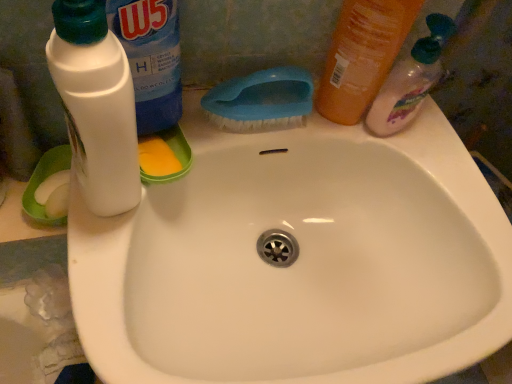
How much space does translucent plastic bottle at upper right, acting as the 2th cleaning product starting from the right, occupy horizontally?

It is 1.96 inches.

This screenshot has width=512, height=384. Identify the location of blue plastic brush at upper center. point(261,100).

Locate an element on the screen. This screenshot has height=384, width=512. translucent plastic bottle at upper right, which is the third cleaning product in left-to-right order is located at coordinates click(x=410, y=80).

Does white matte bottle at left come in front of translucent plastic bottle at upper right, marked as the 1th cleaning product in a right-to-left arrangement?

Yes, white matte bottle at left is closer to the camera.

I want to click on cleaning product that is the 1st one when counting upward from the white matte bottle at left (from the image's perspective), so click(410, 80).

Considering the sizes of white matte bottle at left and translucent plastic bottle at upper right, which is the third cleaning product in left-to-right order, in the image, is white matte bottle at left wider or thinner than translucent plastic bottle at upper right, which is the third cleaning product in left-to-right order,?

white matte bottle at left is wider than translucent plastic bottle at upper right, which is the third cleaning product in left-to-right order.

Which of these two, white matte bottle at left or translucent plastic bottle at upper right, marked as the 1th cleaning product in a right-to-left arrangement, is bigger?

With larger size is white matte bottle at left.

In the image, is translucent plastic bottle at upper right, marked as the 1th cleaning product in a right-to-left arrangement, positioned in front of or behind translucent plastic bottle at upper right, the 2th cleaning product from the left?

translucent plastic bottle at upper right, marked as the 1th cleaning product in a right-to-left arrangement, is behind translucent plastic bottle at upper right, the 2th cleaning product from the left.

How many degrees apart are the facing directions of translucent plastic bottle at upper right, marked as the 1th cleaning product in a right-to-left arrangement, and translucent plastic bottle at upper right, acting as the 2th cleaning product starting from the right?

translucent plastic bottle at upper right, marked as the 1th cleaning product in a right-to-left arrangement, and translucent plastic bottle at upper right, acting as the 2th cleaning product starting from the right, are facing 59.7 degrees away from each other.

Is translucent plastic bottle at upper right, marked as the 1th cleaning product in a right-to-left arrangement, thinner than translucent plastic bottle at upper right, the 2th cleaning product from the left?

In fact, translucent plastic bottle at upper right, marked as the 1th cleaning product in a right-to-left arrangement, might be wider than translucent plastic bottle at upper right, the 2th cleaning product from the left.

From a real-world perspective, which object rests below the other?

translucent plastic bottle at upper right, marked as the 1th cleaning product in a right-to-left arrangement, from a real-world perspective.

Which of these two, white glossy sink at center or white plastic bottle at upper left, the 3th cleaning product viewed from the right, is thinner?

white plastic bottle at upper left, the 3th cleaning product viewed from the right.

Does point (443, 151) lie behind point (148, 47)?

Yes, point (443, 151) is behind point (148, 47).

Which is correct: white glossy sink at center is inside white plastic bottle at upper left, the 1th cleaning product from the left, or outside of it?

white glossy sink at center is not enclosed by white plastic bottle at upper left, the 1th cleaning product from the left.

Could you tell me if white glossy sink at center is facing white plastic bottle at upper left, the 1th cleaning product from the left?

No, white glossy sink at center is not turned towards white plastic bottle at upper left, the 1th cleaning product from the left.

Is blue plastic brush at upper center at the right side of white matte bottle at left?

Yes.

Considering the relative sizes of blue plastic brush at upper center and white matte bottle at left in the image provided, is blue plastic brush at upper center taller than white matte bottle at left?

No, blue plastic brush at upper center is not taller than white matte bottle at left.

From the image's perspective, who appears lower, blue plastic brush at upper center or white matte bottle at left?

white matte bottle at left.

Considering the positions of objects blue plastic brush at upper center and white matte bottle at left in the image provided, who is behind, blue plastic brush at upper center or white matte bottle at left?

blue plastic brush at upper center is further away from the camera.

From a real-world perspective, which cleaning product is the 2nd one above the blue plastic brush at upper center? Please provide its 2D coordinates.

[(362, 55)]

Is point (386, 16) positioned before point (295, 83)?

Yes.

Does translucent plastic bottle at upper right, acting as the 2th cleaning product starting from the right, appear on the left side of blue plastic brush at upper center?

No.

Could you tell me if translucent plastic bottle at upper right, the 2th cleaning product from the left, is facing blue plastic brush at upper center?

No, translucent plastic bottle at upper right, the 2th cleaning product from the left, is not turned towards blue plastic brush at upper center.

Is white glossy sink at center oriented towards translucent plastic bottle at upper right, the 2th cleaning product from the left?

No.

Which cleaning product is the 1st one when counting from the back of the white glossy sink at center? Please provide its 2D coordinates.

[(362, 55)]

In terms of width, does white glossy sink at center look wider or thinner when compared to translucent plastic bottle at upper right, acting as the 2th cleaning product starting from the right?

white glossy sink at center is wider than translucent plastic bottle at upper right, acting as the 2th cleaning product starting from the right.

Is blue plastic brush at upper center looking in the opposite direction of white glossy sink at center?

blue plastic brush at upper center does not have its back to white glossy sink at center.

Is blue plastic brush at upper center to the right of white glossy sink at center from the viewer's perspective?

No, blue plastic brush at upper center is not to the right of white glossy sink at center.

In the scene shown: Based on their sizes in the image, would you say blue plastic brush at upper center is bigger or smaller than white glossy sink at center?

Clearly, blue plastic brush at upper center is smaller in size than white glossy sink at center.

I want to click on bottle on the left of translucent plastic bottle at upper right, marked as the 1th cleaning product in a right-to-left arrangement, so click(96, 105).

Which cleaning product is the 1st one when counting from the front of the translucent plastic bottle at upper right, which is the third cleaning product in left-to-right order? Please provide its 2D coordinates.

[(362, 55)]

Based on their spatial positions, is translucent plastic bottle at upper right, acting as the 2th cleaning product starting from the right, or white matte bottle at left further from translucent plastic bottle at upper right, which is the third cleaning product in left-to-right order?

white matte bottle at left lies further to translucent plastic bottle at upper right, which is the third cleaning product in left-to-right order, than the other object.

Looking at the image, which one is located closer to translucent plastic bottle at upper right, which is the third cleaning product in left-to-right order, translucent plastic bottle at upper right, acting as the 2th cleaning product starting from the right, or blue plastic brush at upper center?

translucent plastic bottle at upper right, acting as the 2th cleaning product starting from the right.

Considering their positions, is blue plastic brush at upper center positioned further to white plastic bottle at upper left, the 3th cleaning product viewed from the right, than white matte bottle at left?

blue plastic brush at upper center lies further to white plastic bottle at upper left, the 3th cleaning product viewed from the right, than the other object.

From the image, which object appears to be nearer to white glossy sink at center, translucent plastic bottle at upper right, marked as the 1th cleaning product in a right-to-left arrangement, or white matte bottle at left?

translucent plastic bottle at upper right, marked as the 1th cleaning product in a right-to-left arrangement.

Considering their positions, is white glossy sink at center positioned closer to white matte bottle at left than blue plastic brush at upper center?

blue plastic brush at upper center.

Considering their positions, is translucent plastic bottle at upper right, marked as the 1th cleaning product in a right-to-left arrangement, positioned closer to translucent plastic bottle at upper right, acting as the 2th cleaning product starting from the right, than white matte bottle at left?

translucent plastic bottle at upper right, marked as the 1th cleaning product in a right-to-left arrangement, is positioned closer to the anchor translucent plastic bottle at upper right, acting as the 2th cleaning product starting from the right.

From the picture: Based on their spatial positions, is translucent plastic bottle at upper right, which is the third cleaning product in left-to-right order, or blue plastic brush at upper center further from translucent plastic bottle at upper right, the 2th cleaning product from the left?

Among the two, blue plastic brush at upper center is located further to translucent plastic bottle at upper right, the 2th cleaning product from the left.

Based on their spatial positions, is white matte bottle at left or translucent plastic bottle at upper right, which is the third cleaning product in left-to-right order, closer to white glossy sink at center?

Among the two, translucent plastic bottle at upper right, which is the third cleaning product in left-to-right order, is located nearer to white glossy sink at center.

Where is `sink between white matte bottle at left and translucent plastic bottle at upper right, acting as the 2th cleaning product starting from the right`? This screenshot has height=384, width=512. sink between white matte bottle at left and translucent plastic bottle at upper right, acting as the 2th cleaning product starting from the right is located at coordinates point(298,257).

Locate an element on the screen. sink situated between white matte bottle at left and translucent plastic bottle at upper right, marked as the 1th cleaning product in a right-to-left arrangement, from left to right is located at coordinates (298, 257).

Identify the location of cleaning product situated between blue plastic brush at upper center and translucent plastic bottle at upper right, marked as the 1th cleaning product in a right-to-left arrangement, from left to right. The image size is (512, 384). (362, 55).

Find the location of a particular element. brush between translucent plastic bottle at upper right, which is the third cleaning product in left-to-right order, and white glossy sink at center, in the vertical direction is located at coordinates (261, 100).